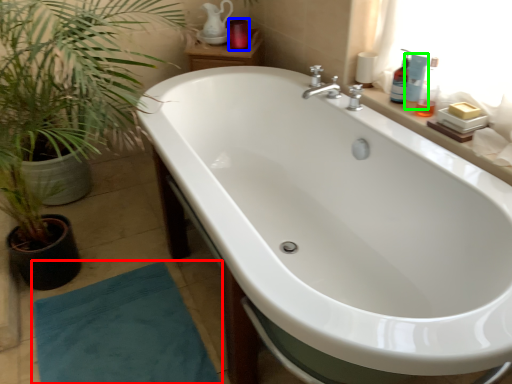
Question: Considering the real-world distances, which object is farthest from doormat (highlighted by a red box)? toiletry (highlighted by a blue box) or toiletry (highlighted by a green box)?

Choices:
 (A) toiletry
 (B) toiletry

Answer: (A)